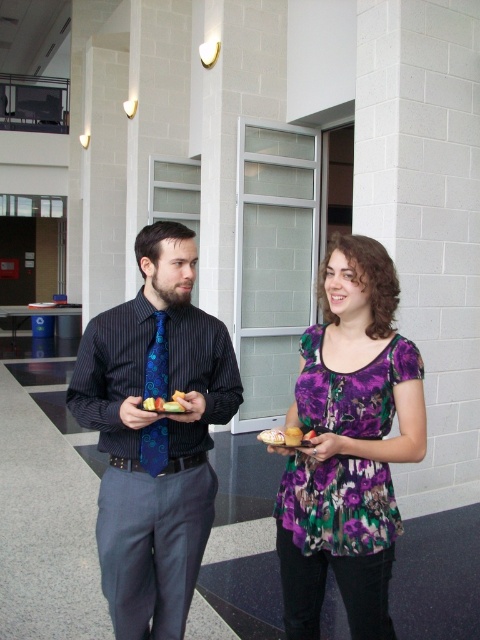
How distant is blue silk tie at center from smooth yellow cake at center?

The distance of blue silk tie at center from smooth yellow cake at center is 5.28 inches.

The width and height of the screenshot is (480, 640). I want to click on blue silk tie at center, so click(156, 362).

Find the location of a particular element. The height and width of the screenshot is (640, 480). blue silk tie at center is located at coordinates (156, 362).

Can you confirm if purple floral dress at center is taller than blue silk tie at center?

Indeed, purple floral dress at center has a greater height compared to blue silk tie at center.

Is purple floral dress at center wider than blue silk tie at center?

Indeed, purple floral dress at center has a greater width compared to blue silk tie at center.

The width and height of the screenshot is (480, 640). Describe the element at coordinates (348, 445) in the screenshot. I see `purple floral dress at center` at that location.

At what (x,y) coordinates should I click in order to perform the action: click on purple floral dress at center. Please return your answer as a coordinate pair (x, y). The width and height of the screenshot is (480, 640). Looking at the image, I should click on (348, 445).

Image resolution: width=480 pixels, height=640 pixels. Identify the location of matte blue tie at center. (348, 445).

Between matte blue tie at center and smooth white bread at center, which one has less height?

Standing shorter between the two is smooth white bread at center.

Which is behind, point (414, 420) or point (265, 436)?

Positioned behind is point (414, 420).

You are a GUI agent. You are given a task and a screenshot of the screen. Output one action in this format:
    pyautogui.click(x=<x>, y=<y>)
    Task: Click on the matte blue tie at center
    
    Given the screenshot: What is the action you would take?
    pyautogui.click(x=348, y=445)